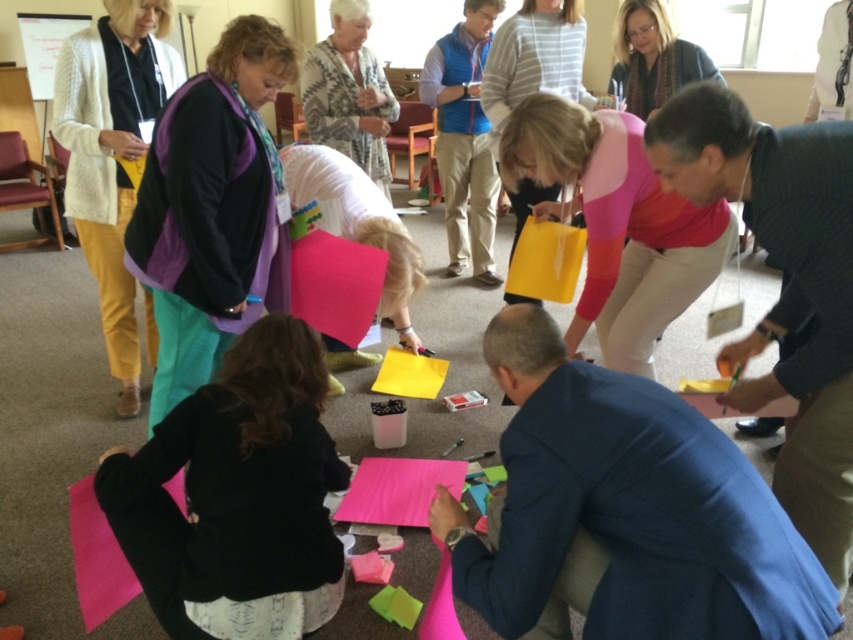
Question: Does patterned sweater at upper center lie in front of matte brown sweater at upper right?

Choices:
 (A) no
 (B) yes

Answer: (A)

Question: Is purple fleece vest at upper left positioned before pink textured paper at lower center?

Choices:
 (A) no
 (B) yes

Answer: (B)

Question: Which object appears closest to the camera in this image?

Choices:
 (A) black fabric at lower center
 (B) pink fabric at center
 (C) matte yellow folder at center
 (D) purple fleece vest at upper left

Answer: (A)

Question: Among these points, which one is farthest from the camera?

Choices:
 (A) (138, 74)
 (B) (219, 310)
 (C) (590, 115)

Answer: (A)

Question: Does purple fleece vest at upper left have a lesser width compared to pink fabric at center?

Choices:
 (A) yes
 (B) no

Answer: (A)

Question: Which point appears closest to the camera in this image?

Choices:
 (A) (395, 460)
 (B) (136, 403)
 (C) (524, 204)
 (D) (250, 116)

Answer: (D)